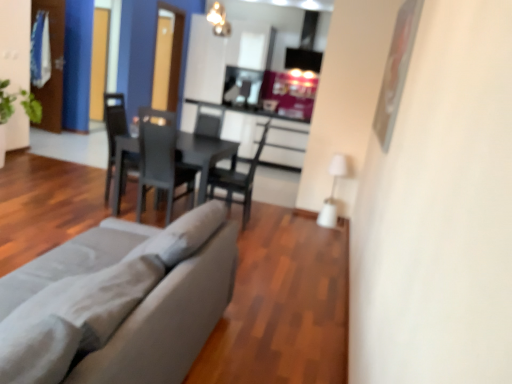
Question: Does transparent glass door at upper left, positioned as the 2th glass door in left-to-right order, lie in front of black matte table at center?

Choices:
 (A) yes
 (B) no

Answer: (B)

Question: Is transparent glass door at upper left, positioned as the 2th glass door in left-to-right order, oriented towards black matte table at center?

Choices:
 (A) yes
 (B) no

Answer: (B)

Question: Are transparent glass door at upper left, positioned as the 2th glass door in left-to-right order, and black matte table at center making contact?

Choices:
 (A) no
 (B) yes

Answer: (A)

Question: From the image's perspective, does transparent glass door at upper left, positioned as the 2th glass door in left-to-right order, appear lower than black matte table at center?

Choices:
 (A) yes
 (B) no

Answer: (B)

Question: Is transparent glass door at upper left, positioned as the 2th glass door in left-to-right order, smaller than black matte table at center?

Choices:
 (A) yes
 (B) no

Answer: (A)

Question: Considering the positions of matte gray chair at center, the second chair positioned from the left, and transparent glass door at upper left, positioned as the 2th glass door in left-to-right order, in the image, is matte gray chair at center, the second chair positioned from the left, taller or shorter than transparent glass door at upper left, positioned as the 2th glass door in left-to-right order,?

Choices:
 (A) tall
 (B) short

Answer: (B)

Question: From the image's perspective, relative to transparent glass door at upper left, positioned as the 2th glass door in left-to-right order, is matte gray chair at center, the second chair positioned from the left, above or below?

Choices:
 (A) below
 (B) above

Answer: (A)

Question: Is matte gray chair at center, which appears as the 1th chair when viewed from the right, bigger or smaller than transparent glass door at upper left, positioned as the 2th glass door in left-to-right order?

Choices:
 (A) big
 (B) small

Answer: (A)

Question: From a real-world perspective, is matte gray chair at center, which appears as the 1th chair when viewed from the right, positioned above or below transparent glass door at upper left, positioned as the 2th glass door in left-to-right order?

Choices:
 (A) above
 (B) below

Answer: (B)

Question: From a real-world perspective, is transparent glass door at upper left, positioned as the 1th glass door in right-to-left order, positioned above or below matte gray chair at center, the second chair positioned from the left?

Choices:
 (A) above
 (B) below

Answer: (A)

Question: In terms of size, does transparent glass door at upper left, positioned as the 1th glass door in right-to-left order, appear bigger or smaller than matte gray chair at center, which appears as the 1th chair when viewed from the right?

Choices:
 (A) big
 (B) small

Answer: (B)

Question: Does point (163, 61) appear closer or farther from the camera than point (224, 178)?

Choices:
 (A) closer
 (B) farther

Answer: (B)

Question: From the image's perspective, is transparent glass door at upper left, positioned as the 2th glass door in left-to-right order, located above or below matte gray chair at center, which appears as the 1th chair when viewed from the right?

Choices:
 (A) below
 (B) above

Answer: (B)

Question: From a real-world perspective, relative to transparent glass door at upper left, which is the 1th glass door in left-to-right order, is matte black chair at center, the 2th chair positioned from the right, vertically above or below?

Choices:
 (A) above
 (B) below

Answer: (B)

Question: Considering the relative positions of matte black chair at center, the 2th chair positioned from the right, and transparent glass door at upper left, which is the 1th glass door in left-to-right order, in the image provided, is matte black chair at center, the 2th chair positioned from the right, to the left or to the right of transparent glass door at upper left, which is the 1th glass door in left-to-right order,?

Choices:
 (A) right
 (B) left

Answer: (A)